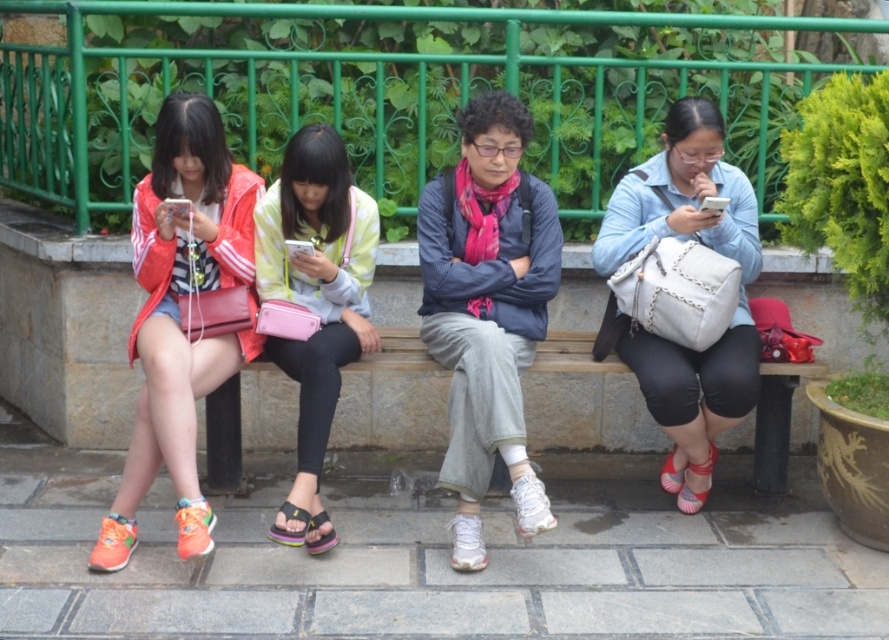
Question: Among these points, which one is nearest to the camera?

Choices:
 (A) (465, 346)
 (B) (181, 116)
 (C) (663, 76)

Answer: (A)

Question: Which is nearer to the black fabric sandal at lower center?

Choices:
 (A) matte blue jacket at center
 (B) matte pink sandal at lower right
 (C) shiny orange sneakers at left
 (D) light blue denim shirt at center

Answer: (C)

Question: Is pastel yellow jacket at center bigger than black fabric sandal at lower center?

Choices:
 (A) no
 (B) yes

Answer: (B)

Question: Can you confirm if matte blue jacket at center is positioned below black fabric sandal at lower center?

Choices:
 (A) no
 (B) yes

Answer: (A)

Question: Does matte blue jacket at center have a greater width compared to light blue denim shirt at center?

Choices:
 (A) yes
 (B) no

Answer: (B)

Question: Which point is farther to the camera?

Choices:
 (A) (699, 371)
 (B) (327, 516)

Answer: (A)